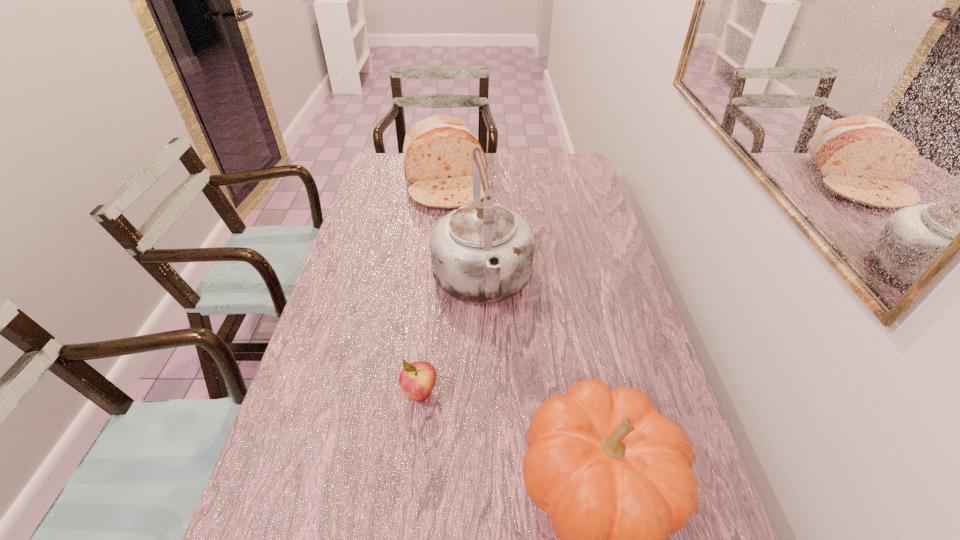
Identify the location of the shortest object. This screenshot has height=540, width=960. (417, 379).

I want to click on the third farthest object, so 417,379.

Locate an element on the screen. This screenshot has height=540, width=960. the farthest object is located at coordinates (437, 152).

Locate an element on the screen. the third nearest object is located at coordinates (482, 252).

Image resolution: width=960 pixels, height=540 pixels. I want to click on kettle, so click(x=482, y=252).

The width and height of the screenshot is (960, 540). I want to click on free space located 0.390m on the right of the shortest object, so click(x=599, y=394).

The height and width of the screenshot is (540, 960). In order to click on vacant position located 0.130m at the sliced end of the farthest object in this screenshot , I will do `click(459, 235)`.

You are a GUI agent. You are given a task and a screenshot of the screen. Output one action in this format:
    pyautogui.click(x=<x>, y=<y>)
    Task: Click on the free location located 0.110m at the sliced end of the farthest object
    Image resolution: width=960 pixels, height=540 pixels.
    Given the screenshot: What is the action you would take?
    pyautogui.click(x=458, y=232)

The height and width of the screenshot is (540, 960). What are the coordinates of `blank space located at the sliced end of the farthest object` in the screenshot? It's located at (467, 259).

Identify the location of vacant space located 0.370m at the spout of the tallest object. This screenshot has height=540, width=960. (516, 462).